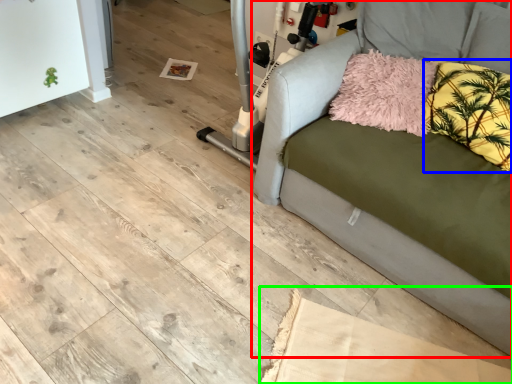
Question: Which object is positioned farthest from studio couch (highlighted by a red box)? Select from pillow (highlighted by a blue box) and cardboard (highlighted by a green box).

Choices:
 (A) pillow
 (B) cardboard

Answer: (B)